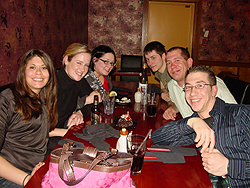
Locate an element on the screen. Image resolution: width=250 pixels, height=188 pixels. table is located at coordinates (151, 172).